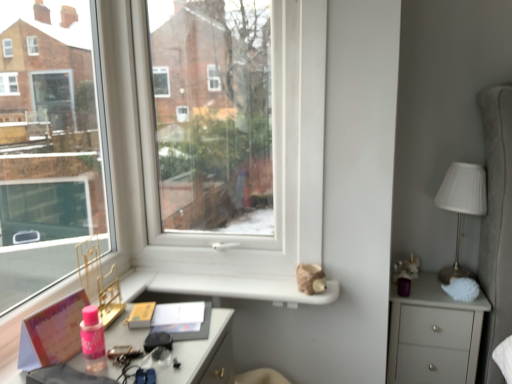
Where is `pink matte book at lower left`? The image size is (512, 384). pink matte book at lower left is located at coordinates pos(52,333).

Measure the distance between point [81,292] and camera.

Point [81,292] and camera are 4.29 feet apart.

The height and width of the screenshot is (384, 512). Find the location of `pink matte book at lower left`. pink matte book at lower left is located at coordinates (52, 333).

Is white ribbed fabric at right not close to pink matte book at lower left?

That's right, there is a large distance between white ribbed fabric at right and pink matte book at lower left.

Can you tell me how much white ribbed fabric at right and pink matte book at lower left differ in facing direction?

The angular difference between white ribbed fabric at right and pink matte book at lower left is 79.9 degrees.

Between point (478, 169) and point (72, 320), which one is positioned behind?

The point (478, 169) is farther from the camera.

From the picture: In terms of height, does transparent glass window at center look taller or shorter compared to white ribbed fabric at right?

transparent glass window at center is taller than white ribbed fabric at right.

Would you say transparent glass window at center is inside or outside white ribbed fabric at right?

transparent glass window at center is not enclosed by white ribbed fabric at right.

Between transparent glass window at center and white ribbed fabric at right, which one has smaller width?

With smaller width is transparent glass window at center.

Is transparent glass window at center oriented towards white ribbed fabric at right?

No, transparent glass window at center does not turn towards white ribbed fabric at right.

Considering the relative sizes of white ribbed fabric at right and transparent glass window at center in the image provided, is white ribbed fabric at right wider than transparent glass window at center?

Correct, the width of white ribbed fabric at right exceeds that of transparent glass window at center.

Is white ribbed fabric at right behind transparent glass window at center?

Yes, white ribbed fabric at right is further from the viewer.

From the picture: Is white ribbed fabric at right bigger than transparent glass window at center?

Actually, white ribbed fabric at right might be smaller than transparent glass window at center.

Which point is more forward, (x=452, y=188) or (x=233, y=207)?

The point (x=452, y=188) is closer.

I want to click on window screen located in front of the matte gray chest of drawers at right, so click(x=215, y=121).

Which point is more distant from viewer, (252, 98) or (435, 327)?

The point (435, 327) is farther from the camera.

Is matte gray chest of drawers at right surrounded by transparent glass window at center?

No, matte gray chest of drawers at right is located outside of transparent glass window at center.

From the picture: Would you say matte gray chest of drawers at right is inside or outside white ribbed fabric at right?

matte gray chest of drawers at right is not enclosed by white ribbed fabric at right.

Is point (439, 332) closer to viewer compared to point (472, 186)?

Yes.

From a real-world perspective, is matte gray chest of drawers at right located higher than white ribbed fabric at right?

No.

Which of these two, matte gray chest of drawers at right or white ribbed fabric at right, stands taller?

matte gray chest of drawers at right is taller.

Relative to white ribbed fabric at right, is pink matte book at lower left in front or behind?

pink matte book at lower left is positioned closer to the viewer than white ribbed fabric at right.

Looking at the image, does pink matte book at lower left seem bigger or smaller compared to white ribbed fabric at right?

pink matte book at lower left is smaller than white ribbed fabric at right.

From a real-world perspective, does pink matte book at lower left stand above white ribbed fabric at right?

No, from a real-world perspective, pink matte book at lower left is not on top of white ribbed fabric at right.

Would you say pink matte book at lower left is a long distance from white ribbed fabric at right?

Yes, pink matte book at lower left and white ribbed fabric at right are located far from each other.

Identify the location of window screen that appears above the pink matte book at lower left (from a real-world perspective). coord(215,121).

Between point (254, 70) and point (58, 348), which one is positioned in front?

Point (58, 348)

Is transparent glass window at center positioned before pink matte book at lower left?

No.

I want to click on book in front of the white ribbed fabric at right, so tap(52, 333).

Image resolution: width=512 pixels, height=384 pixels. I want to click on table lamp below the transparent glass window at center (from a real-world perspective), so click(461, 205).

When comparing their distances from transparent glass window at center, does matte gray chest of drawers at right or pink matte book at lower left seem further?

Among the two, matte gray chest of drawers at right is located further to transparent glass window at center.

Which object lies nearer to the anchor point white ribbed fabric at right, transparent glass window at center or pink matte book at lower left?

transparent glass window at center is closer to white ribbed fabric at right.

Which object lies further to the anchor point white ribbed fabric at right, matte gray chest of drawers at right or pink matte book at lower left?

pink matte book at lower left lies further to white ribbed fabric at right than the other object.

Based on their spatial positions, is transparent glass window at center or pink matte book at lower left further from matte gray chest of drawers at right?

pink matte book at lower left is positioned further to the anchor matte gray chest of drawers at right.

Considering their positions, is transparent glass window at center positioned closer to matte gray chest of drawers at right than white ribbed fabric at right?

white ribbed fabric at right lies closer to matte gray chest of drawers at right than the other object.

Considering their positions, is transparent glass window at center positioned closer to pink matte book at lower left than matte gray chest of drawers at right?

transparent glass window at center.

Estimate the real-world distances between objects in this image. Which object is closer to white ribbed fabric at right, matte gray chest of drawers at right or transparent glass window at center?

The object closer to white ribbed fabric at right is matte gray chest of drawers at right.

Estimate the real-world distances between objects in this image. Which object is closer to transparent glass window at center, pink matte book at lower left or white ribbed fabric at right?

Based on the image, pink matte book at lower left appears to be nearer to transparent glass window at center.

The height and width of the screenshot is (384, 512). In order to click on the chest of drawers located between transparent glass window at center and white ribbed fabric at right in the left-right direction in this screenshot , I will do `click(433, 334)`.

The image size is (512, 384). What are the coordinates of `chest of drawers between pink matte book at lower left and white ribbed fabric at right from left to right` in the screenshot? It's located at (433, 334).

The image size is (512, 384). In order to click on window screen between pink matte book at lower left and white ribbed fabric at right in the horizontal direction in this screenshot , I will do `click(215, 121)`.

This screenshot has height=384, width=512. In order to click on window screen between pink matte book at lower left and matte gray chest of drawers at right in the horizontal direction in this screenshot , I will do `click(215, 121)`.